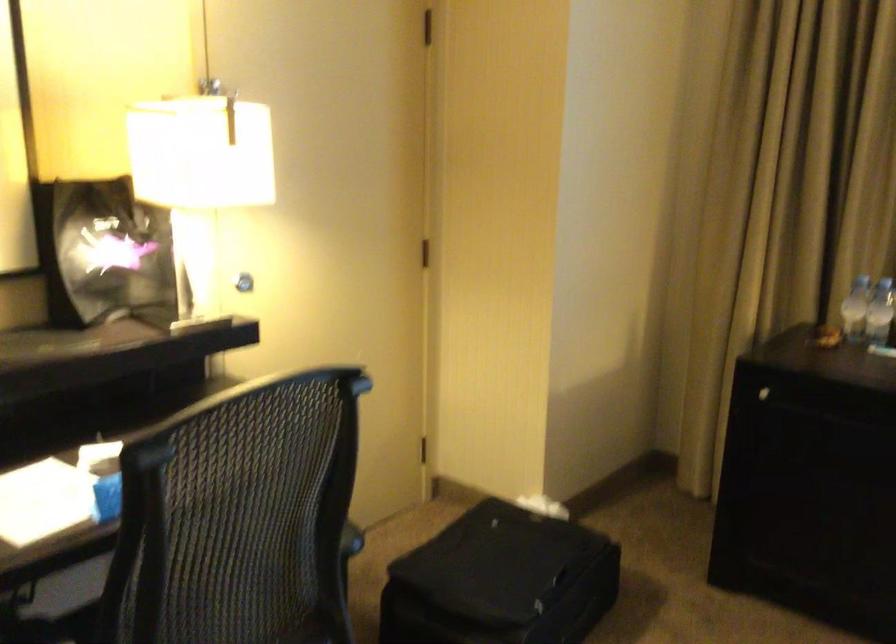
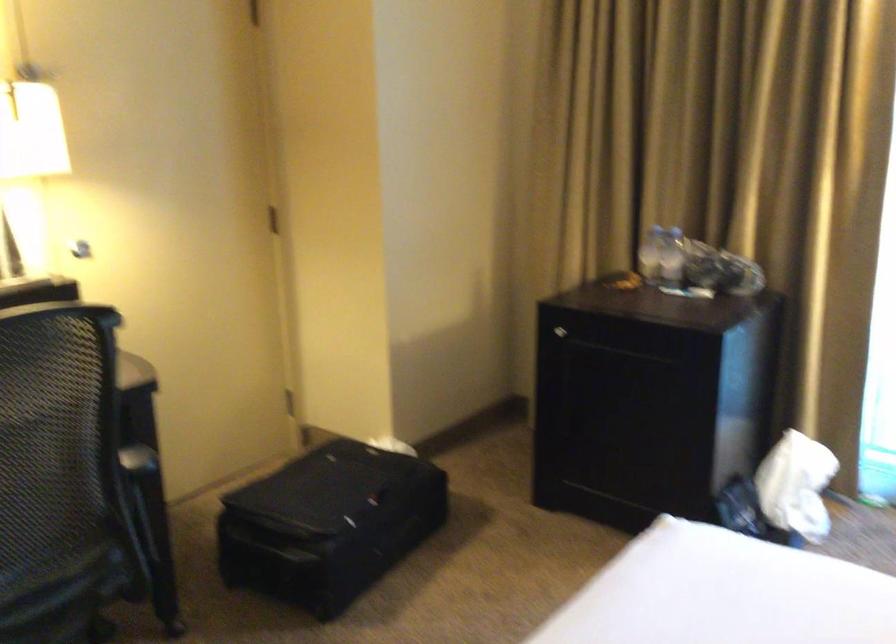
Locate, in the second image, the point that corresponds to pixel 757 391 in the first image.

(560, 330)